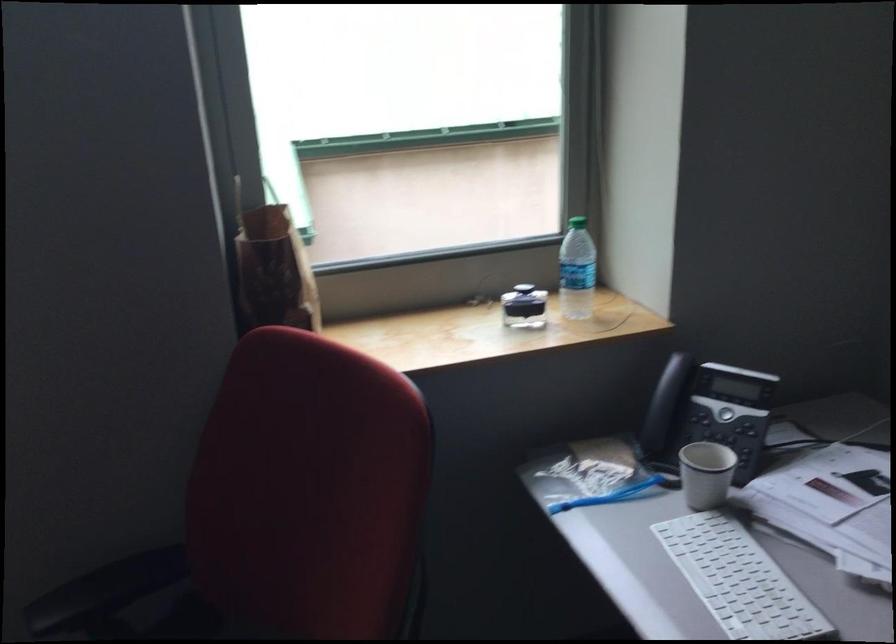
Describe the element at coordinates (607, 495) in the screenshot. I see `the blue ziploc slider` at that location.